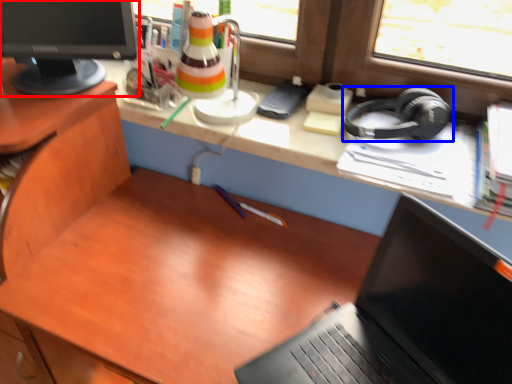
Question: Which object is further to the camera taking this photo, computer monitor (highlighted by a red box) or headphones (highlighted by a blue box)?

Choices:
 (A) computer monitor
 (B) headphones

Answer: (B)